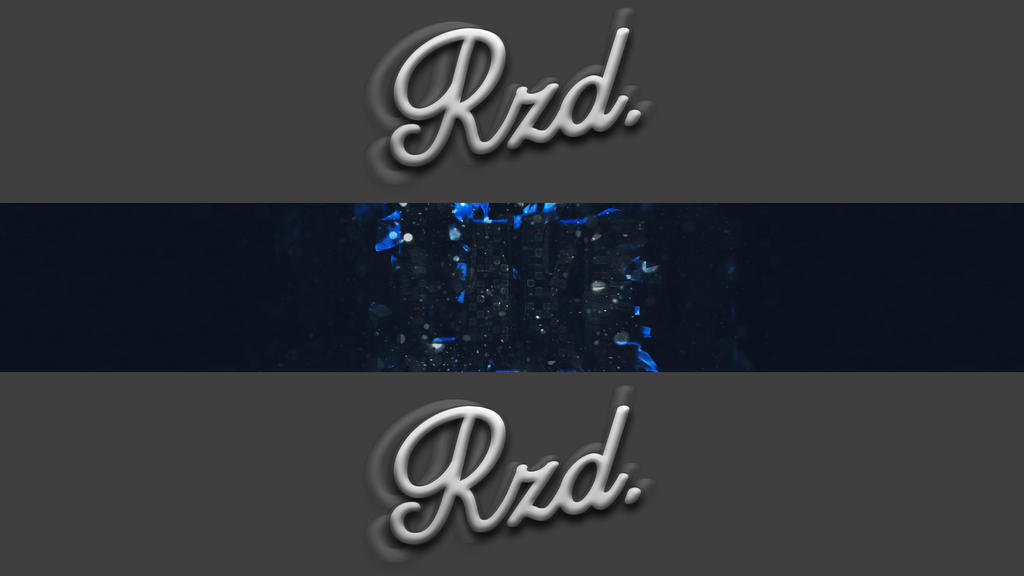
This screenshot has height=576, width=1024. I want to click on light areas, so click(454, 223).